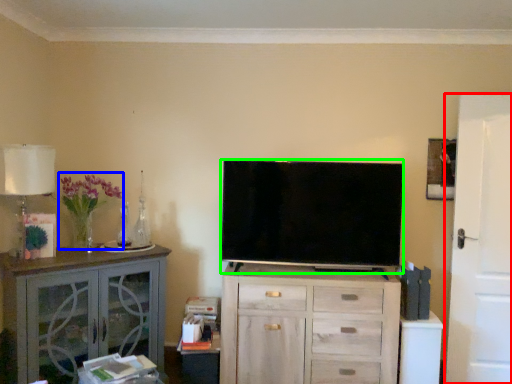
Question: Estimate the real-world distances between objects in this image. Which object is farther from door (highlighted by a red box), flower (highlighted by a blue box) or television (highlighted by a green box)?

Choices:
 (A) flower
 (B) television

Answer: (A)